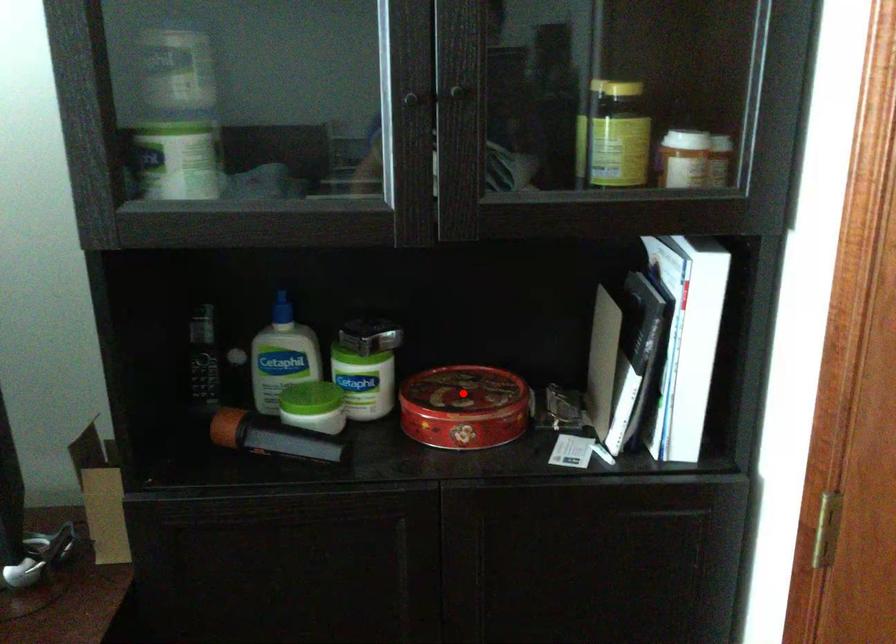
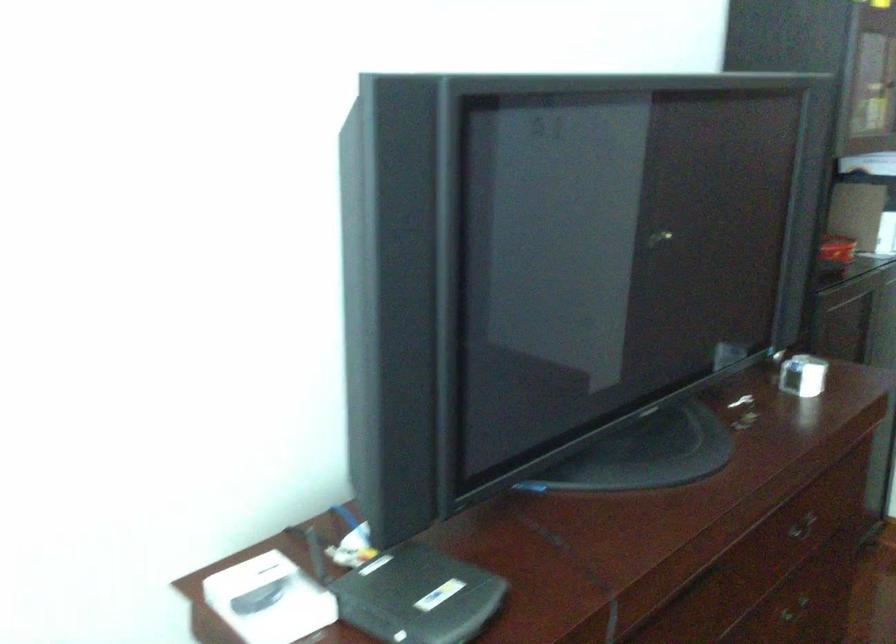
Question: I am providing you with two images of the same scene from different viewpoints. A red point is marked on the first image. Is the red point's position out of view in image 2?

Choices:
 (A) Yes
 (B) No

Answer: (A)